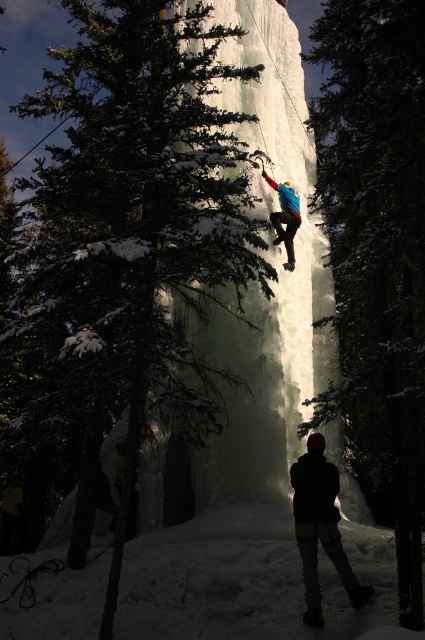
You are an ice climber preparing to ascend the ice wall. You notice a green textured tree at center in your path. Based on its position, can you determine if the tree is directly in front of the ice wall or behind it?

The green textured tree at center is located at point (376, 246), which places it behind the ice wall since the coordinates suggest it is positioned further back in the scene compared to the climber and the ice wall.